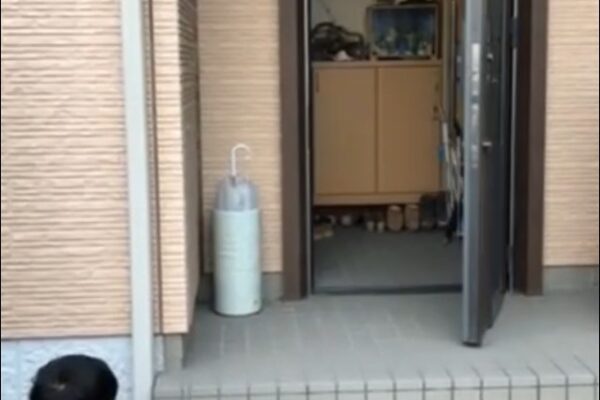
Locate an element on the screen. The image size is (600, 400). beige wall is located at coordinates (44, 226).